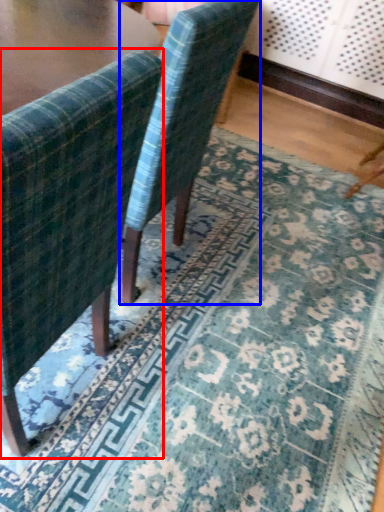
Question: Which object is further to the camera taking this photo, chair (highlighted by a red box) or chair (highlighted by a blue box)?

Choices:
 (A) chair
 (B) chair

Answer: (B)